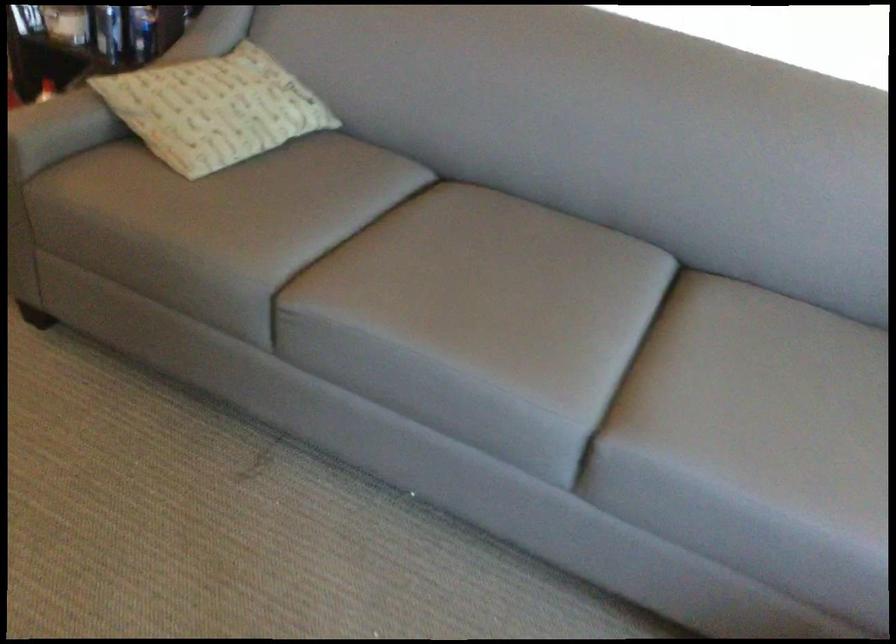
Where is `grey sofa armrest`? grey sofa armrest is located at coordinates (32, 125).